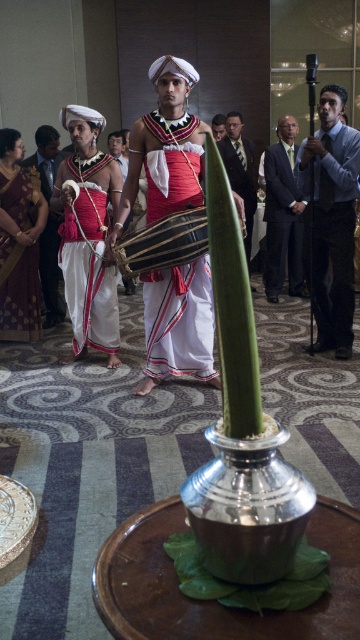
Does white silk sari at left have a greater height compared to smooth black suit at center?

Yes.

Which of these two, white silk sari at left or smooth black suit at center, stands taller?

white silk sari at left is taller.

Find the location of `white silk sari at left`. white silk sari at left is located at coordinates (51, 269).

The width and height of the screenshot is (360, 640). In order to click on white silk sari at left in this screenshot , I will do `click(51, 269)`.

Can you confirm if dark blue shirt at right is wider than dark gray suit at center?

In fact, dark blue shirt at right might be narrower than dark gray suit at center.

Is dark blue shirt at right to the right of dark gray suit at center from the viewer's perspective?

In fact, dark blue shirt at right is to the left of dark gray suit at center.

At what (x,y) coordinates should I click in order to perform the action: click on dark blue shirt at right. Please return your answer as a coordinate pair (x, y). Looking at the image, I should click on pos(331,218).

Locate an element on the screen. dark blue shirt at right is located at coordinates (331, 218).

This screenshot has height=640, width=360. Describe the element at coordinates (19, 243) in the screenshot. I see `maroon silk saree at left` at that location.

Is maroon silk saree at left taller than matte white shirt at center?

Correct, maroon silk saree at left is much taller as matte white shirt at center.

Is point (3, 196) positioned behind point (218, 116)?

No, (3, 196) is in front of (218, 116).

Find the location of a particular element. maroon silk saree at left is located at coordinates (19, 243).